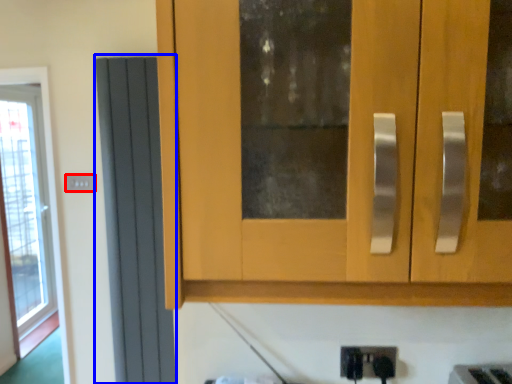
Question: Which object is closer to the camera taking this photo, electric outlet (highlighted by a red box) or screen door (highlighted by a blue box)?

Choices:
 (A) electric outlet
 (B) screen door

Answer: (B)